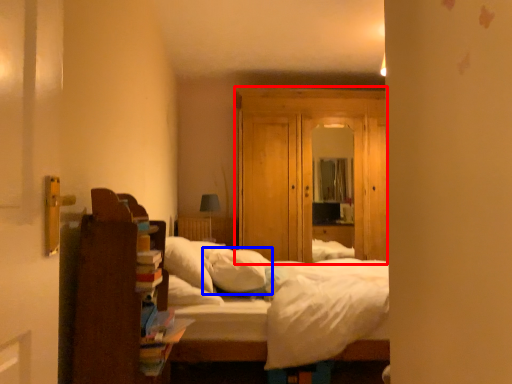
Question: Which point is closer to the camera, dresser (highlighted by a red box) or pillow (highlighted by a blue box)?

Choices:
 (A) dresser
 (B) pillow

Answer: (B)